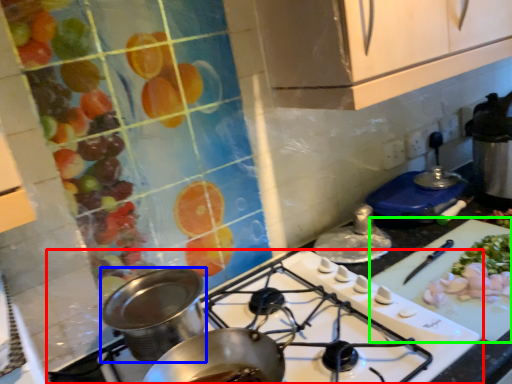
Question: Which object is the farthest from gas stove (highlighted by a red box)? Choose among these: kitchen appliance (highlighted by a blue box) or cutting board (highlighted by a green box).

Choices:
 (A) kitchen appliance
 (B) cutting board

Answer: (A)